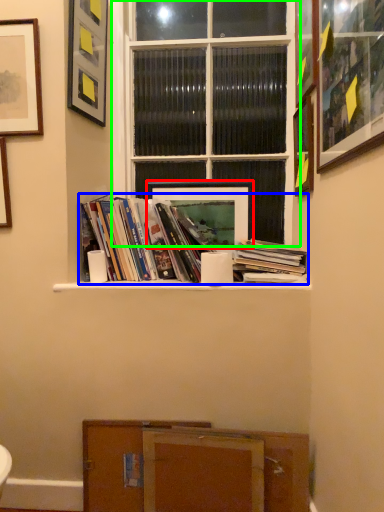
Question: Estimate the real-world distances between objects in this image. Which object is closer to picture frame (highlighted by a red box), book (highlighted by a blue box) or window (highlighted by a green box)?

Choices:
 (A) book
 (B) window

Answer: (A)